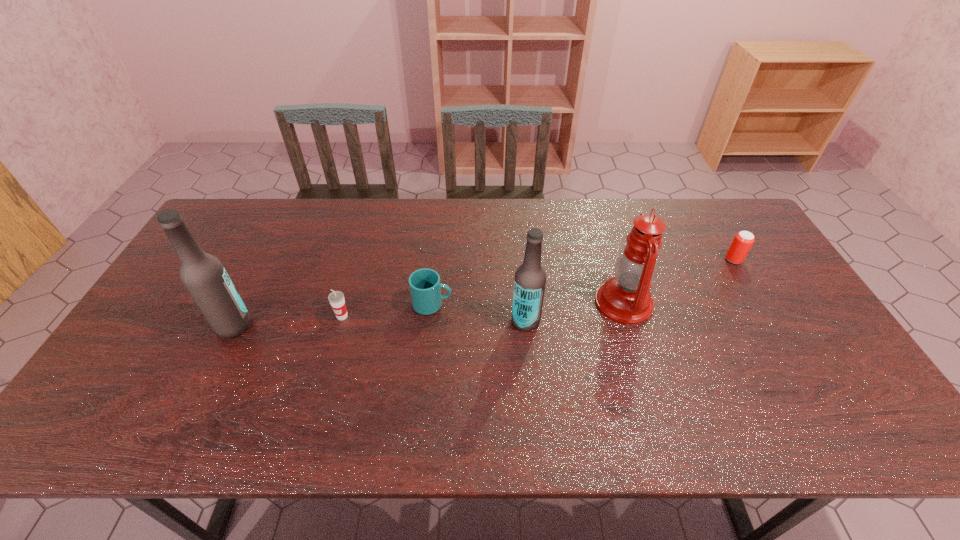
Where is `the taller beer bottle`? the taller beer bottle is located at coordinates (203, 275).

This screenshot has width=960, height=540. Identify the location of the leftmost object. (203, 275).

Identify the location of the shorter beer bottle. The image size is (960, 540). (530, 278).

The image size is (960, 540). Identify the location of the third object from right to left. (530, 278).

At what (x,y) coordinates should I click in order to perform the action: click on the rightmost object. Please return your answer as a coordinate pair (x, y). Looking at the image, I should click on (743, 240).

What are the coordinates of `beer can` in the screenshot? It's located at (743, 240).

Locate an element on the screen. the fourth object from right to left is located at coordinates (425, 288).

You are a GUI agent. You are given a task and a screenshot of the screen. Output one action in this format:
    pyautogui.click(x=<x>, y=<y>)
    Task: Click on the second object from right to left
    This screenshot has width=960, height=540.
    Given the screenshot: What is the action you would take?
    pyautogui.click(x=625, y=298)

Locate an element on the screen. the second object from left to right is located at coordinates (336, 298).

Where is `vacant region located on the label of the taller beer bottle`? The image size is (960, 540). vacant region located on the label of the taller beer bottle is located at coordinates (395, 325).